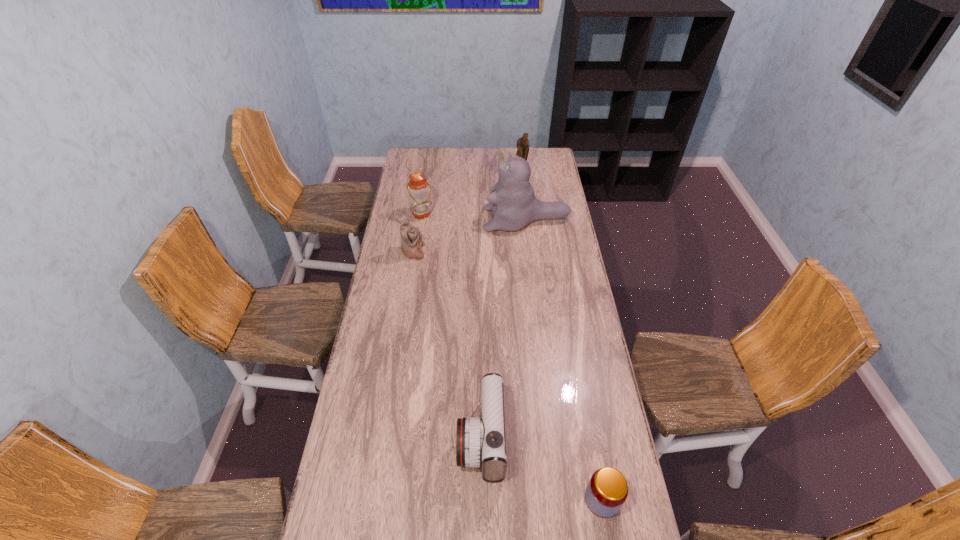
I want to click on free spot located 0.330m on the face of the cat, so click(416, 219).

Locate an element on the screen. Image resolution: width=960 pixels, height=540 pixels. vacant region located on the back of the oil lamp is located at coordinates (427, 176).

Identify the location of free space located 0.400m on the front-facing side of the right figurine. This screenshot has width=960, height=540. (526, 219).

Locate an element on the screen. blank space located 0.240m on the front-facing side of the left figurine is located at coordinates (478, 252).

You are a GUI agent. You are given a task and a screenshot of the screen. Output one action in this format:
    pyautogui.click(x=<x>, y=<y>)
    Task: Click on the vacant area situated on the surface of the fifth tallest object
    The width and height of the screenshot is (960, 540).
    Given the screenshot: What is the action you would take?
    click(x=424, y=438)

Locate an element on the screen. Image resolution: width=960 pixels, height=540 pixels. vacant space positioned on the surface of the fifth tallest object is located at coordinates (376, 438).

Find the location of a particular element. This screenshot has height=540, width=960. free spot located on the surface of the fifth tallest object is located at coordinates (405, 438).

Locate an element on the screen. vacant space located 0.310m on the back of the shortest object is located at coordinates (582, 388).

Image resolution: width=960 pixels, height=540 pixels. What are the coordinates of `oil lamp that is at the left edge` in the screenshot? It's located at tap(420, 203).

This screenshot has height=540, width=960. Identify the location of figurine located at the left edge. (411, 238).